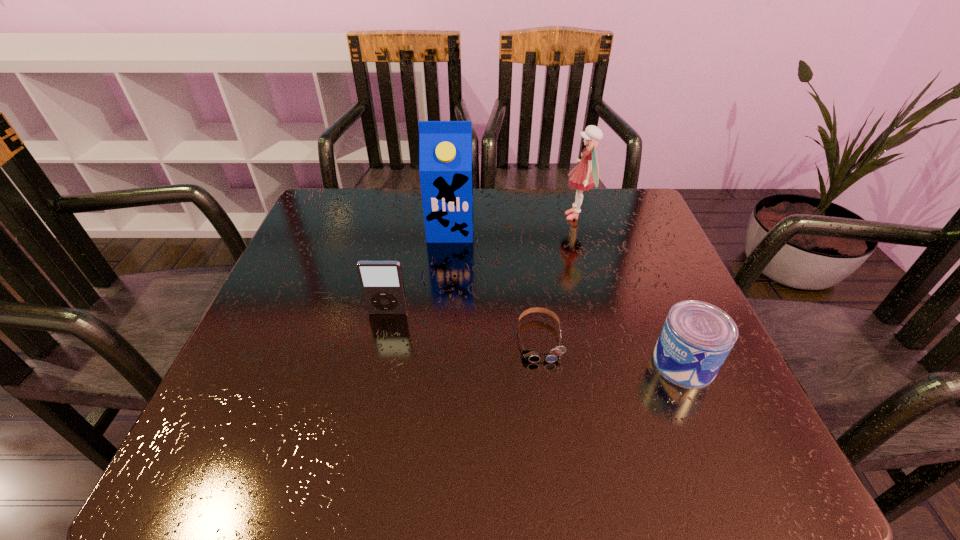
The width and height of the screenshot is (960, 540). I want to click on free area in between the iPod and the goggles, so click(x=464, y=326).

Find the location of a particular element. The height and width of the screenshot is (540, 960). free space between the goggles and the doll is located at coordinates click(558, 278).

Image resolution: width=960 pixels, height=540 pixels. Find the location of `empty space that is in between the fourth object from right to left and the third object from right to left`. empty space that is in between the fourth object from right to left and the third object from right to left is located at coordinates (495, 284).

Locate an element on the screen. This screenshot has width=960, height=540. vacant space in between the can and the third nearest object is located at coordinates click(x=536, y=338).

Find the location of a particular element. The width and height of the screenshot is (960, 540). vacant region between the doll and the can is located at coordinates (630, 289).

Where is `free spot between the rightmost object and the second object from right to left`? free spot between the rightmost object and the second object from right to left is located at coordinates (630, 289).

Where is `vacant space that is in between the doll and the shortest object`? The height and width of the screenshot is (540, 960). vacant space that is in between the doll and the shortest object is located at coordinates (558, 278).

The image size is (960, 540). What are the coordinates of `free point between the leftmost object and the goggles` in the screenshot? It's located at [464, 326].

Point out which object is positioned as the second nearest to the goggles. Please provide its 2D coordinates. Your answer should be formatted as a tuple, i.e. [(x, y)], where the tuple contains the x and y coordinates of a point satisfying the conditions above.

[(382, 285)]

Find the location of a particular element. This screenshot has width=960, height=540. the closest object to the third farthest object is located at coordinates (554, 355).